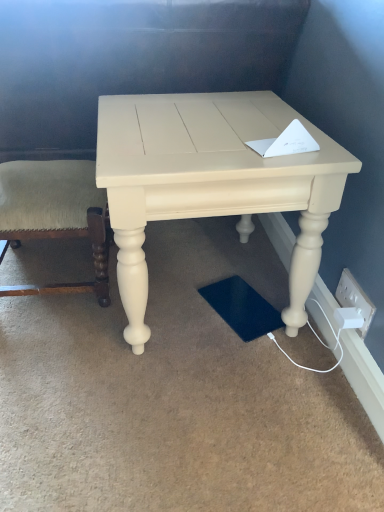
The image size is (384, 512). I want to click on vacant space in front of matte cream table at center, so click(190, 417).